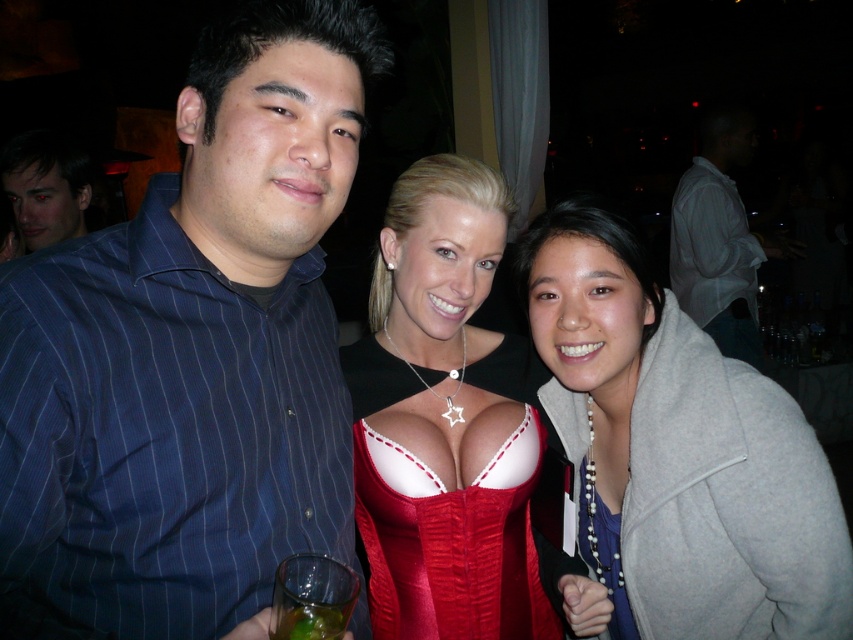
Can you confirm if white striped shirt at upper right is thinner than green translucent liquid at lower left?

Incorrect, white striped shirt at upper right's width is not less than green translucent liquid at lower left's.

Is point (720, 246) farther from camera compared to point (318, 604)?

Yes, it is.

Locate an element on the screen. This screenshot has width=853, height=640. white striped shirt at upper right is located at coordinates (718, 240).

Can you confirm if red satin corset at center is smaller than smooth skin face at upper left?

Yes, red satin corset at center is smaller than smooth skin face at upper left.

Which is above, red satin corset at center or smooth skin face at upper left?

smooth skin face at upper left is above.

Does point (515, 552) come behind point (67, 170)?

That is False.

Find the location of a particular element. The image size is (853, 640). red satin corset at center is located at coordinates (451, 541).

Is red satin corset at center wider than white striped shirt at upper right?

No.

Is red satin corset at center positioned behind white striped shirt at upper right?

No, red satin corset at center is in front of white striped shirt at upper right.

Is point (393, 556) closer to camera compared to point (711, 208)?

Yes, it is in front of point (711, 208).

This screenshot has height=640, width=853. Find the location of `red satin corset at center`. red satin corset at center is located at coordinates (451, 541).